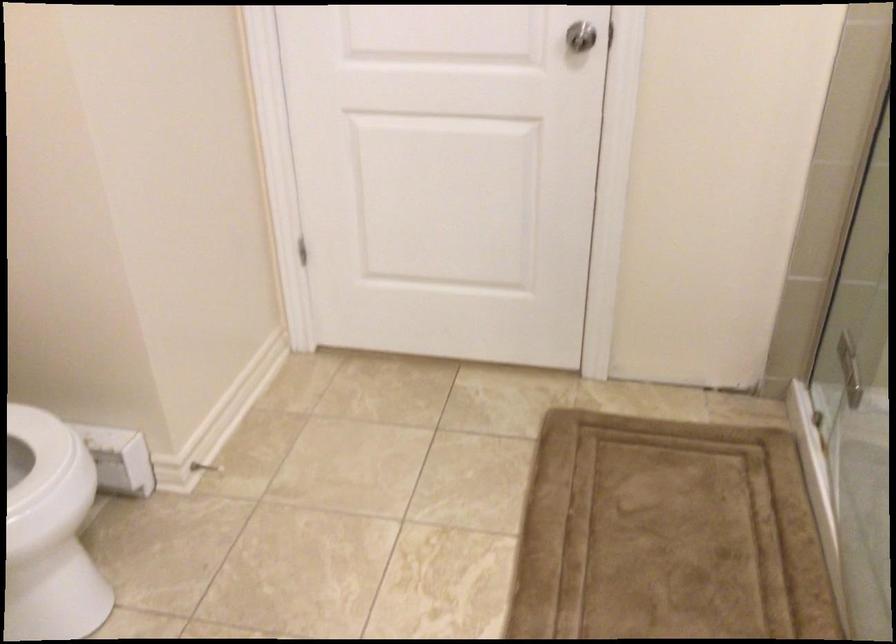
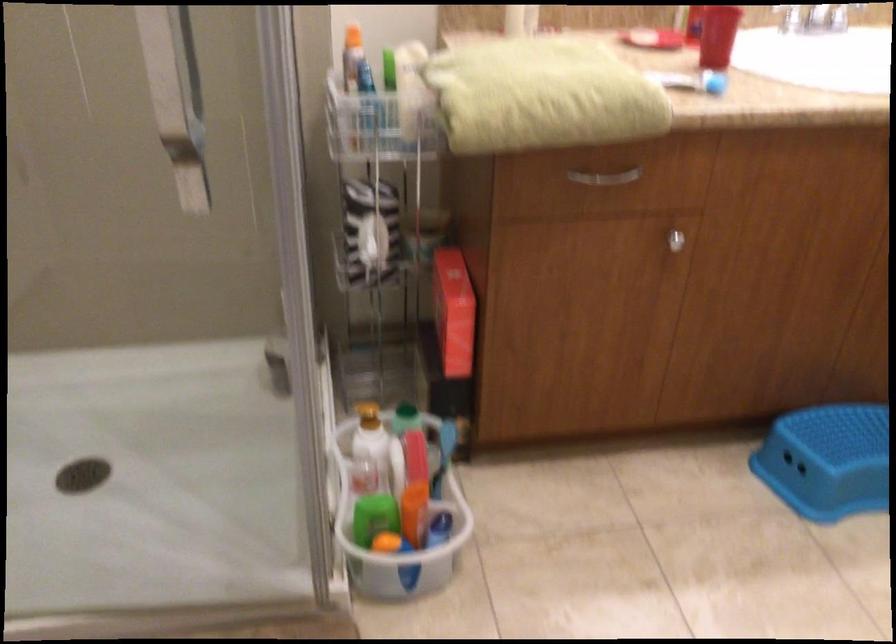
First-person continuous shooting, in which direction is the camera rotating?

The camera's rotation is toward right-down.